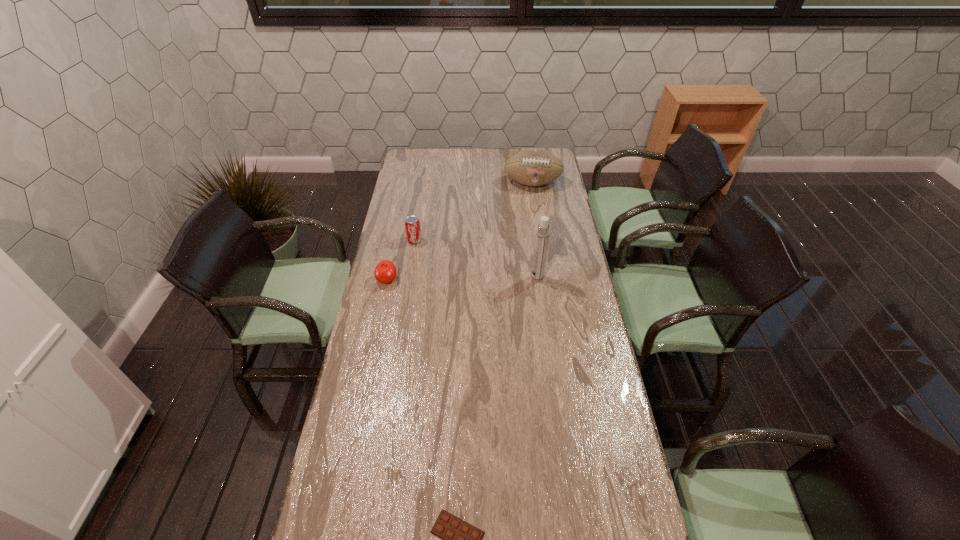
This screenshot has width=960, height=540. Find the location of `vacant space located 0.150m on the right of the fourth tallest object`. vacant space located 0.150m on the right of the fourth tallest object is located at coordinates (435, 280).

Identify the location of soda can that is at the left edge. Image resolution: width=960 pixels, height=540 pixels. (412, 224).

Identify the location of apple at the left edge. The width and height of the screenshot is (960, 540). (385, 272).

Identify the location of object that is at the right edge. (533, 167).

In the image, there is a desktop. Where is `free space at the left edge`? The image size is (960, 540). free space at the left edge is located at coordinates (357, 412).

Identify the location of vacant area at the right edge. (568, 235).

Where is `vacant area that lies between the leftmost object and the farthest object`? This screenshot has width=960, height=540. vacant area that lies between the leftmost object and the farthest object is located at coordinates (460, 232).

This screenshot has width=960, height=540. In order to click on blank region between the soda can and the second shortest object in this screenshot , I will do `click(400, 260)`.

I want to click on vacant area between the apple and the fourth object from right to left, so click(x=400, y=260).

Identify the location of blank region between the leftmost object and the fourth shortest object. The width and height of the screenshot is (960, 540). click(460, 232).